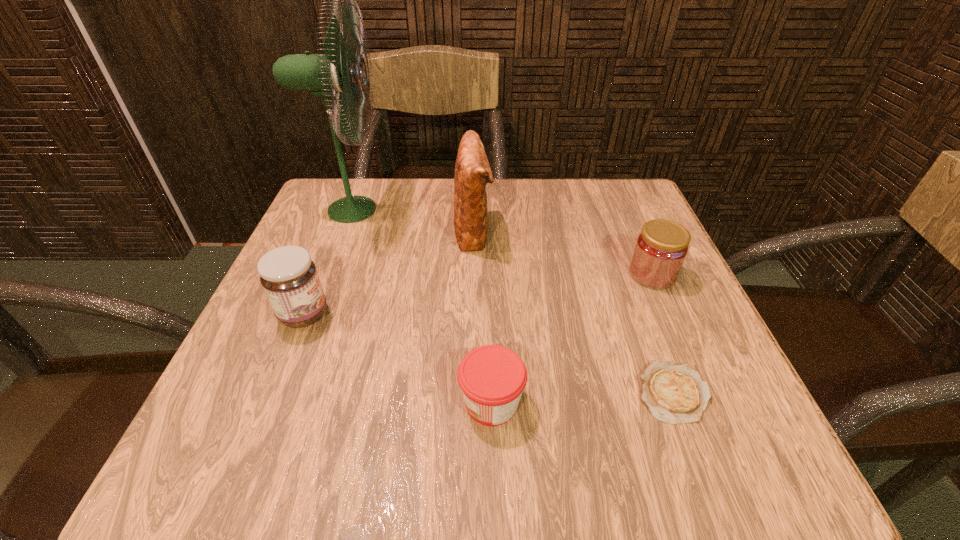
Find the location of a particular element. free location located on the open side of the clutch bag is located at coordinates (568, 231).

Where is `free spot located 0.360m on the front label of the tallest jam`? free spot located 0.360m on the front label of the tallest jam is located at coordinates (540, 314).

I want to click on free space located on the back of the second tallest jam, so click(637, 240).

The width and height of the screenshot is (960, 540). I want to click on vacant space situated on the label side of the nearest jam, so click(374, 402).

Find the location of a particular element. The width and height of the screenshot is (960, 540). vacant space located 0.260m on the label side of the nearest jam is located at coordinates (276, 402).

The width and height of the screenshot is (960, 540). Find the location of `vacant position located 0.100m on the label side of the nearest jam`. vacant position located 0.100m on the label side of the nearest jam is located at coordinates (388, 402).

Locate an element on the screen. The width and height of the screenshot is (960, 540). free point located on the left of the shortest object is located at coordinates (458, 392).

I want to click on fan at the far edge, so click(337, 73).

Where is `clutch bag that is positioned at the far edge`? This screenshot has height=540, width=960. clutch bag that is positioned at the far edge is located at coordinates (472, 171).

Image resolution: width=960 pixels, height=540 pixels. I want to click on jam present at the near edge, so click(492, 378).